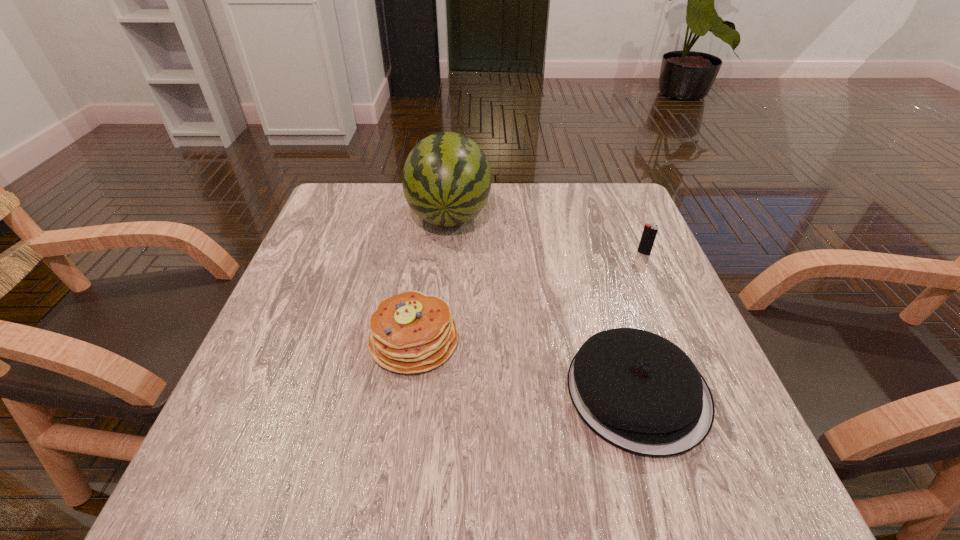
What are the coordinates of `object positioned at the far edge` in the screenshot? It's located at (446, 180).

Where is `object that is positioned at the near edge`? This screenshot has width=960, height=540. object that is positioned at the near edge is located at coordinates (638, 391).

Locate an element on the screen. The image size is (960, 540). igniter that is positioned at the right edge is located at coordinates (650, 231).

At what (x,y) coordinates should I click in order to perform the action: click on pancake positioned at the right edge. Please return your answer as a coordinate pair (x, y). Looking at the image, I should click on (638, 391).

At what (x,y) coordinates should I click in order to perform the action: click on object that is at the near right corner. Please return your answer as a coordinate pair (x, y). This screenshot has height=540, width=960. Looking at the image, I should click on (638, 391).

Find the location of a particular element. vacant space at the far edge of the desktop is located at coordinates (534, 205).

Where is `free space at the near edge of the desktop`? free space at the near edge of the desktop is located at coordinates (549, 503).

You are a GUI agent. You are given a task and a screenshot of the screen. Output one action in this format:
    pyautogui.click(x=<x>, y=<y>)
    Task: Click on the blank area at the left edge
    Image resolution: width=960 pixels, height=540 pixels.
    Given the screenshot: What is the action you would take?
    pyautogui.click(x=301, y=294)

Image resolution: width=960 pixels, height=540 pixels. I want to click on vacant position at the right edge of the desktop, so click(x=672, y=329).

At what (x,y) coordinates should I click in order to perform the action: click on vacant space at the far left corner. Please return your answer as a coordinate pair (x, y). This screenshot has width=960, height=540. Looking at the image, I should click on (341, 227).